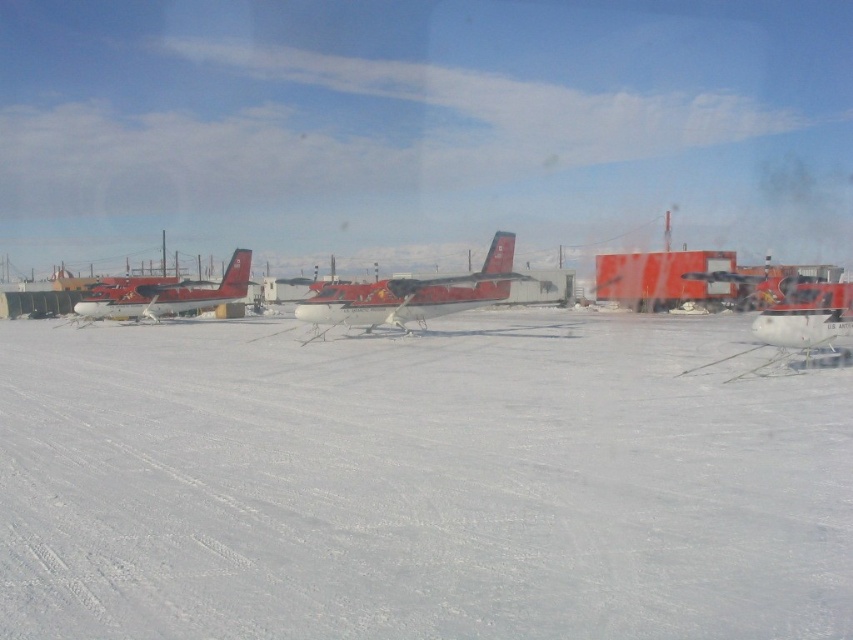
How distant is white matte airplane at right from matte red airplane at center?

30.69 meters

Is white matte airplane at right wider than matte red airplane at center?

In fact, white matte airplane at right might be narrower than matte red airplane at center.

Identify the location of white matte airplane at right. (799, 324).

Which is more to the right, white matte snow at center or matte red airplane at center?

white matte snow at center

Can you confirm if white matte snow at center is smaller than matte red airplane at center?

Yes.

Is point (90, 403) farther from camera compared to point (238, 262)?

No, it is not.

The height and width of the screenshot is (640, 853). Identify the location of white matte snow at center. [419, 484].

Based on the photo, can you confirm if white matte snow at center is bigger than metallic red airplane at center?

Indeed, white matte snow at center has a larger size compared to metallic red airplane at center.

Is white matte snow at center positioned behind metallic red airplane at center?

No, it is in front of metallic red airplane at center.

Between point (76, 333) and point (405, 292), which one is positioned in front?

Positioned in front is point (405, 292).

What are the coordinates of `white matte snow at center` in the screenshot? It's located at (419, 484).